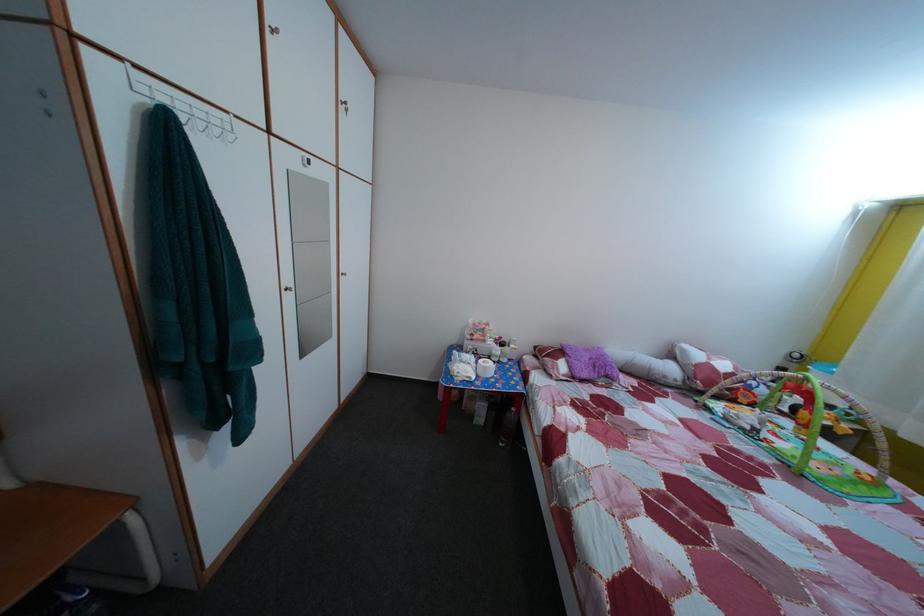
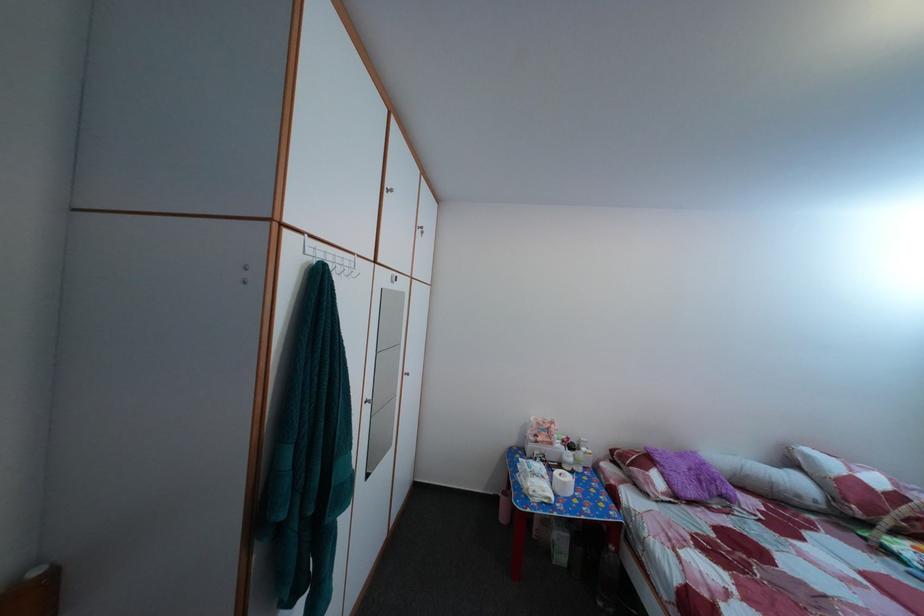
In the second image, find the point that corresponds to (x=473, y=381) in the first image.

(551, 500)